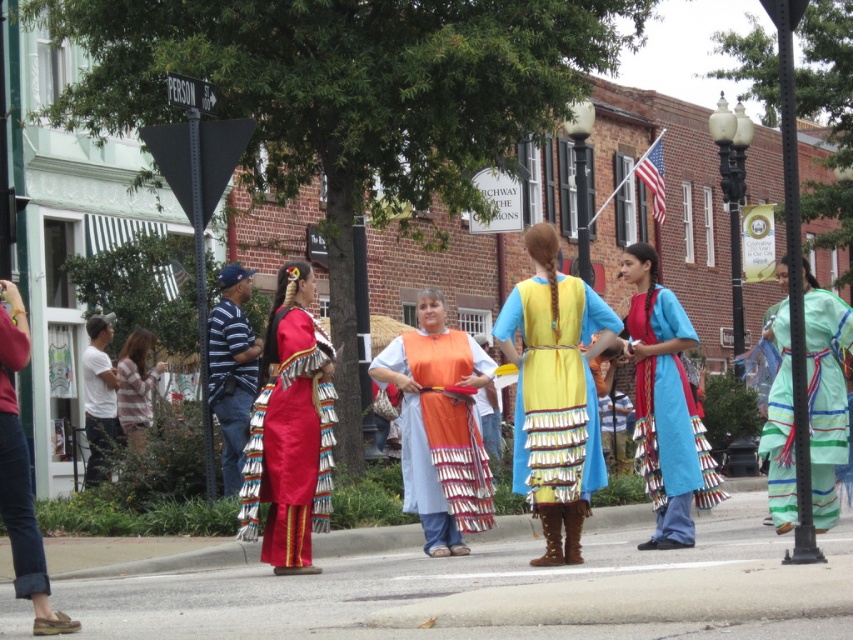
Between denim pants at lower left and striped fabric dress at lower left, which one is positioned lower?

striped fabric dress at lower left is below.

Where is `denim pants at lower left`? denim pants at lower left is located at coordinates (16, 460).

The height and width of the screenshot is (640, 853). Describe the element at coordinates (16, 460) in the screenshot. I see `denim pants at lower left` at that location.

The width and height of the screenshot is (853, 640). What are the coordinates of `denim pants at lower left` in the screenshot? It's located at (16, 460).

Can you confirm if shiny satin dress at center is positioned to the left of striped fabric dress at lower left?

Incorrect, shiny satin dress at center is not on the left side of striped fabric dress at lower left.

Is shiny satin dress at center to the right of striped fabric dress at lower left from the viewer's perspective?

Indeed, shiny satin dress at center is positioned on the right side of striped fabric dress at lower left.

Where is `shiny satin dress at center`? The height and width of the screenshot is (640, 853). shiny satin dress at center is located at coordinates (289, 429).

Is blue fabric dress at center bigger than orange fabric skirt at center?

No.

Find the location of `blue fabric dress at center`. blue fabric dress at center is located at coordinates (664, 404).